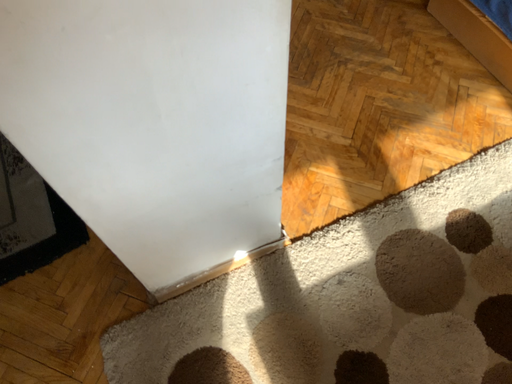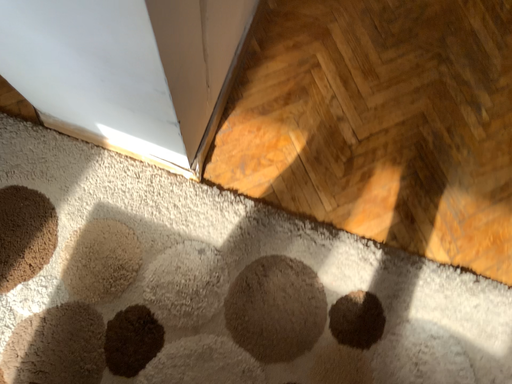
Question: How did the camera likely rotate when shooting the video?

Choices:
 (A) rotated left
 (B) rotated right

Answer: (A)